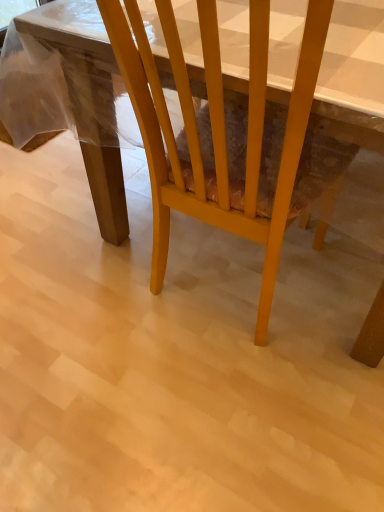
Measure the distance between point (x=123, y=62) and camera.

Point (x=123, y=62) and camera are 31.57 inches apart.

Where is `yellow wood chair at center`? yellow wood chair at center is located at coordinates (215, 127).

The width and height of the screenshot is (384, 512). What do you see at coordinates (215, 127) in the screenshot? I see `yellow wood chair at center` at bounding box center [215, 127].

Locate an element on the screen. The width and height of the screenshot is (384, 512). yellow wood chair at center is located at coordinates (215, 127).